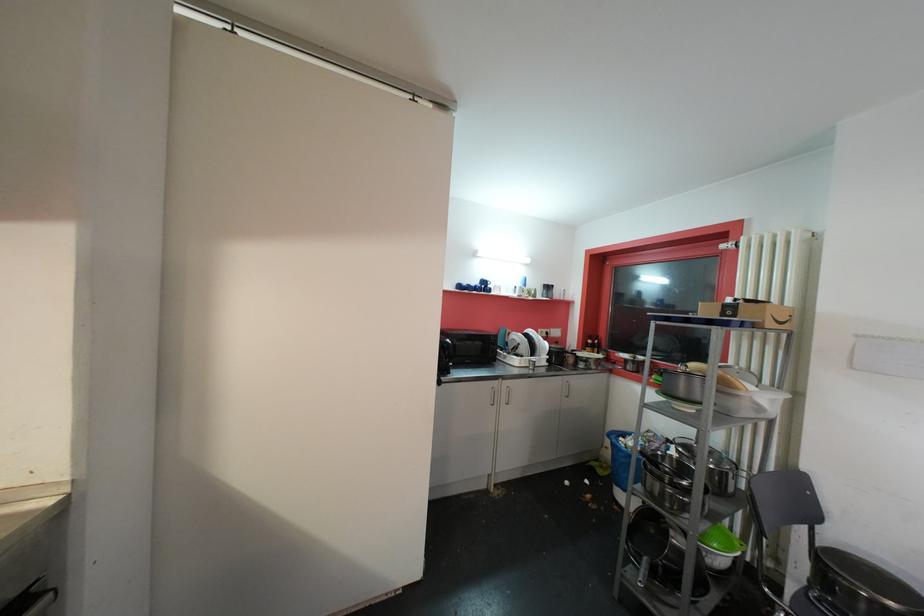
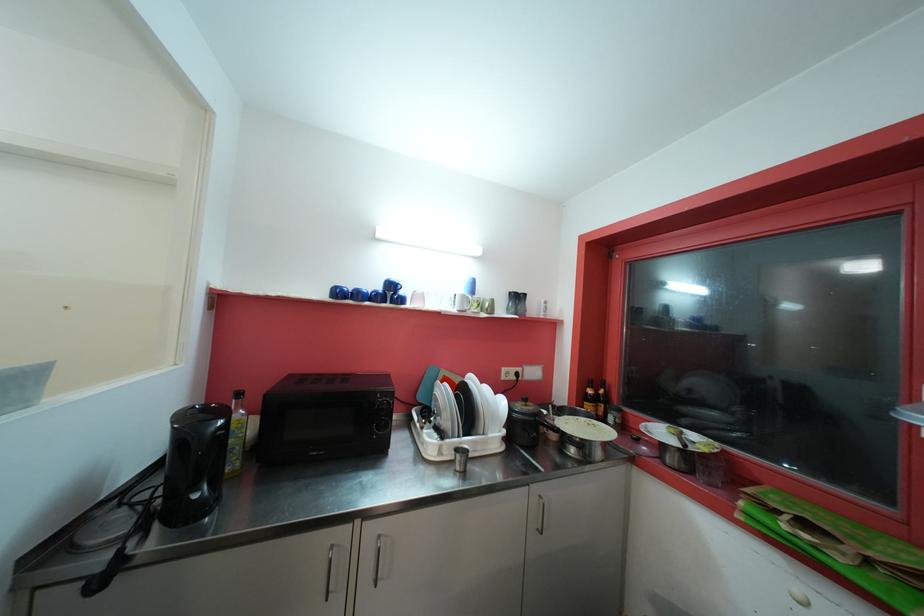
Locate, in the second image, the point that corresponds to the point at 492,288 in the first image.

(399, 294)